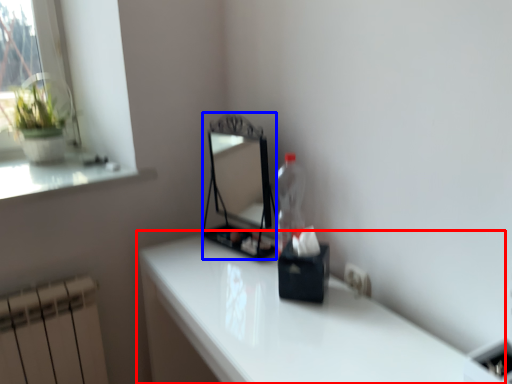
Question: Which object appears closest to the camera in this image, table (highlighted by a red box) or mirror (highlighted by a blue box)?

Choices:
 (A) table
 (B) mirror

Answer: (A)